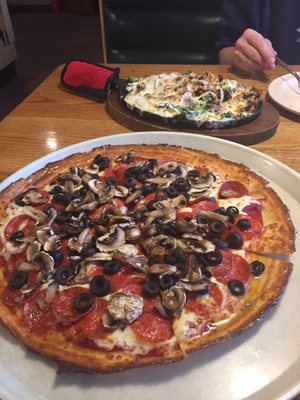
Locate an element on the screen. plate is located at coordinates pyautogui.click(x=289, y=95), pyautogui.click(x=241, y=373).